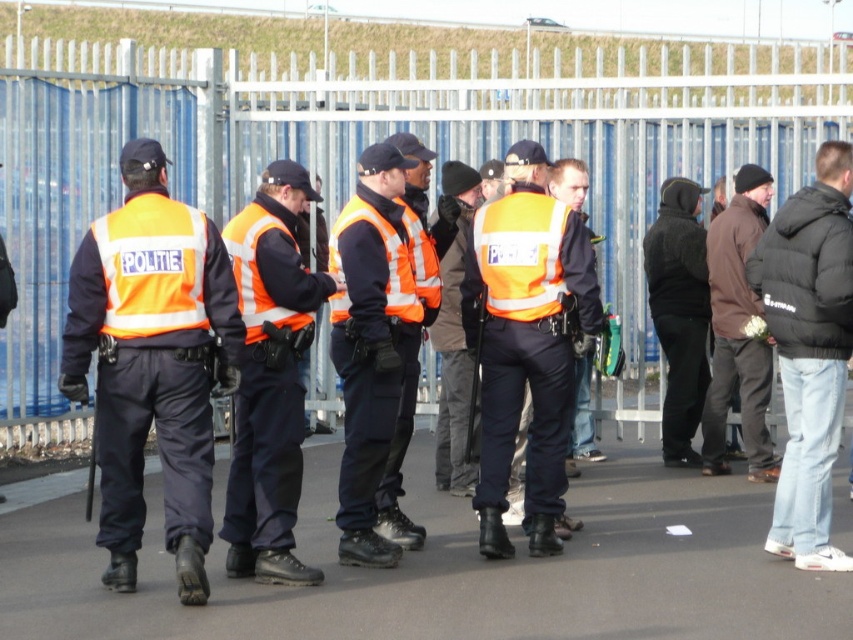
Question: Can you confirm if high-visibility reflective vest at center is thinner than high-visibility fabric uniform at center?

Choices:
 (A) no
 (B) yes

Answer: (A)

Question: Can you confirm if hi-visibility reflective vest at center is positioned above high-visibility fabric uniform at center?

Choices:
 (A) yes
 (B) no

Answer: (B)

Question: Which of the following is the farthest from the observer?

Choices:
 (A) high-visibility reflective vest at left
 (B) brown matte jacket at right
 (C) high-visibility reflective vest at center
 (D) metallic silver fence at upper center

Answer: (B)

Question: Which of the following is the farthest from the observer?

Choices:
 (A) (549, 500)
 (B) (758, 474)
 (C) (273, 486)

Answer: (B)

Question: Can you confirm if high-visibility reflective vest at left is bigger than high-visibility reflective vest at center?

Choices:
 (A) no
 (B) yes

Answer: (B)

Question: Which point appears farthest from the camera in this image?

Choices:
 (A) (753, 433)
 (B) (602, 180)

Answer: (B)